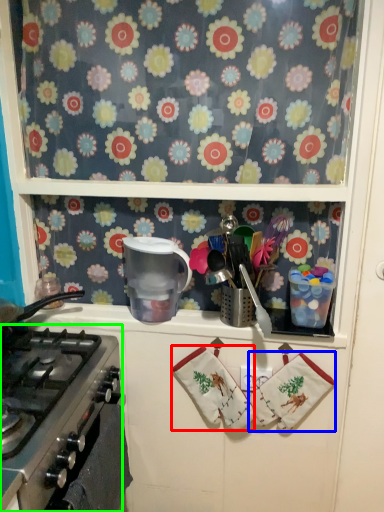
Question: Which object is the closest to the hand towel (highlighted by a red box)? Choose among these: hand towel (highlighted by a blue box) or gas stove (highlighted by a green box).

Choices:
 (A) hand towel
 (B) gas stove

Answer: (A)